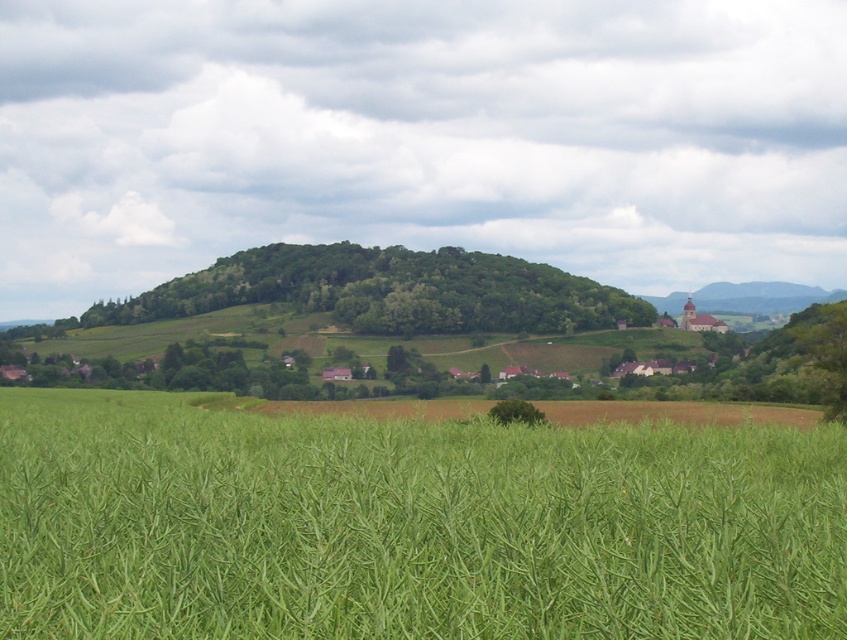
You are standing at the edge of the green grassy field at lower center and want to walk towards the green leafy hill at center. Which direction should you head?

Since the green grassy field at lower center is to the right of the green leafy hill at center, you should head to the left to walk towards the green leafy hill at center.

You are standing in the middle of the rapeseed field in the foreground. You want to walk towards the hill but need to pass by the church first. Is the green leafy hill at center located to the left or right side of the matte brown church at right?

The green leafy hill at center is to the left of the matte brown church at right, so you should head towards the left side of the matte brown church at right to reach the hill.